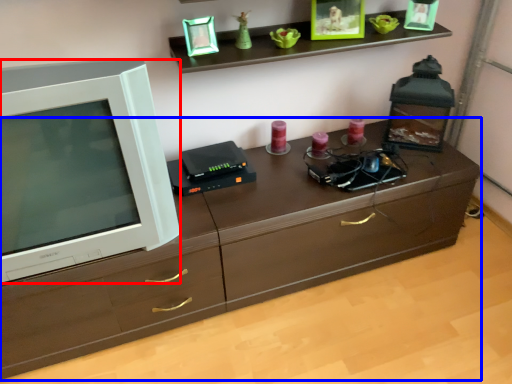
Question: Which of the following is the farthest to the observer, television (highlighted by a red box) or chest of drawers (highlighted by a blue box)?

Choices:
 (A) television
 (B) chest of drawers

Answer: (B)